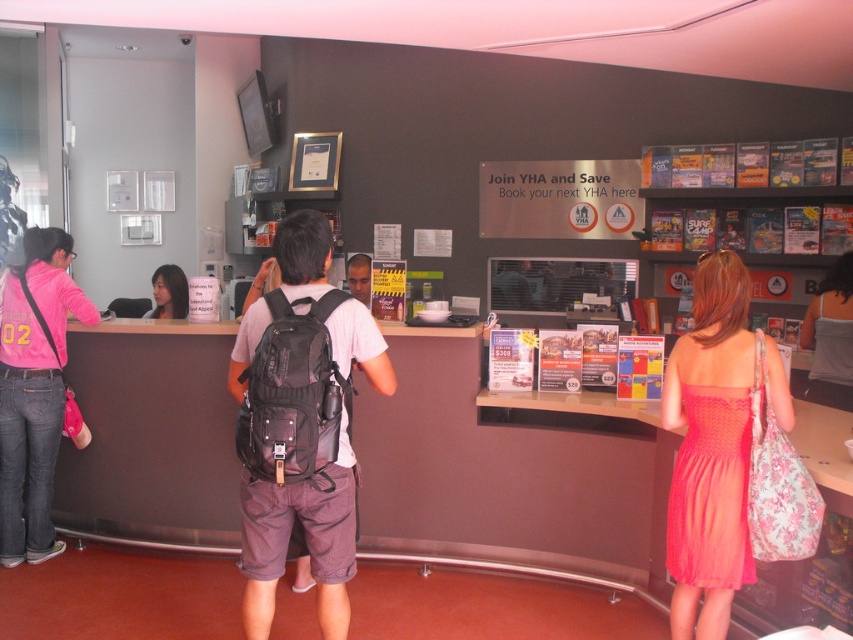
Can you confirm if matte black backpack at center is positioned to the left of pink fabric backpack at left?

No, matte black backpack at center is not to the left of pink fabric backpack at left.

Can you confirm if matte black backpack at center is thinner than pink fabric backpack at left?

In fact, matte black backpack at center might be wider than pink fabric backpack at left.

Locate an element on the screen. matte black backpack at center is located at coordinates (300, 422).

Can you confirm if matte black backpack at center is wider than matte coral dress at center?

Yes, matte black backpack at center is wider than matte coral dress at center.

You are a GUI agent. You are given a task and a screenshot of the screen. Output one action in this format:
    pyautogui.click(x=<x>, y=<y>)
    Task: Click on the matte black backpack at center
    The image size is (853, 640).
    Given the screenshot: What is the action you would take?
    (300, 422)

Measure the distance between matte black backpack at center and camera.

They are 2.11 meters apart.

Locate an element on the screen. matte black backpack at center is located at coordinates (300, 422).

Is matte black backpack at center below matte black hair at center?

Yes, matte black backpack at center is below matte black hair at center.

How far apart are matte black backpack at center and matte black hair at center?

The distance of matte black backpack at center from matte black hair at center is 8.22 feet.

The width and height of the screenshot is (853, 640). I want to click on matte black backpack at center, so click(x=300, y=422).